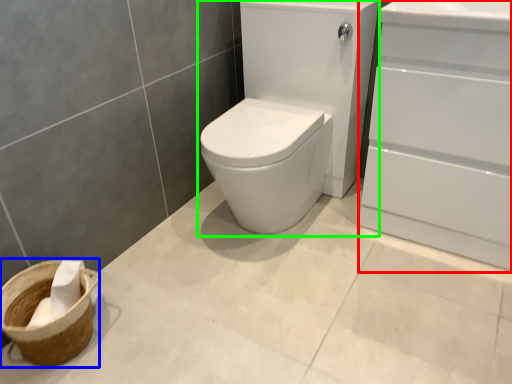
Question: Estimate the real-world distances between objects in this image. Which object is closer to screen door (highlighted by a red box), basket container (highlighted by a blue box) or sink (highlighted by a green box)?

Choices:
 (A) basket container
 (B) sink

Answer: (B)